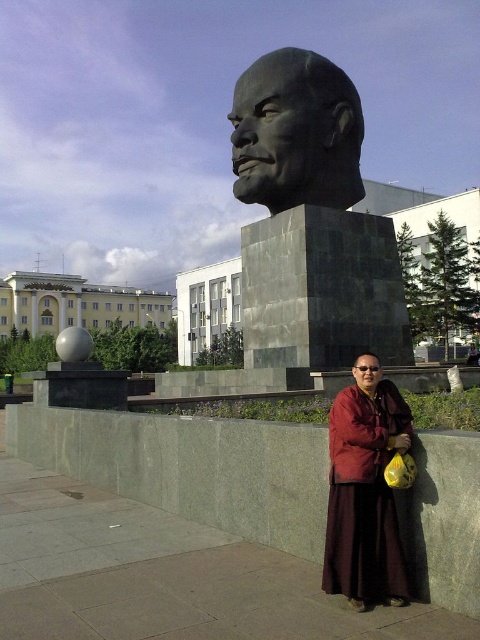
Question: Can you confirm if burgundy woolen robe at lower center is wider than bronze statue at center?

Choices:
 (A) yes
 (B) no

Answer: (B)

Question: Among these points, which one is farthest from the camera?

Choices:
 (A) (356, 432)
 (B) (328, 115)
 (C) (369, 381)
 (D) (257, 61)

Answer: (D)

Question: Which is farther from the bronze statue at center?

Choices:
 (A) gray stone bust at center
 (B) dark gray stone bust at center

Answer: (A)

Question: Does dark gray stone bust at center appear on the left side of gray stone bust at center?

Choices:
 (A) no
 (B) yes

Answer: (B)

Question: Estimate the real-world distances between objects in this image. Which object is closer to the dark gray stone bust at center?

Choices:
 (A) gray stone bust at center
 (B) burgundy woolen robe at lower center
 (C) bronze statue at center

Answer: (A)

Question: Considering the relative positions of dark gray stone bust at center and gray stone bust at center in the image provided, where is dark gray stone bust at center located with respect to gray stone bust at center?

Choices:
 (A) left
 (B) right

Answer: (A)